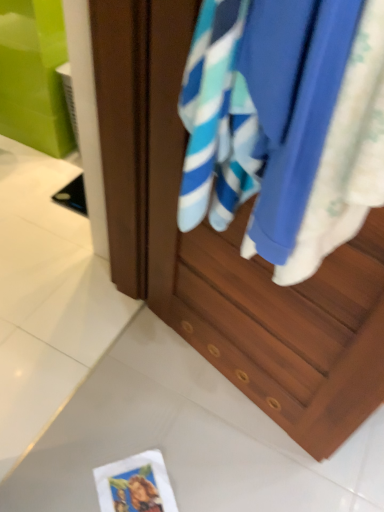
The width and height of the screenshot is (384, 512). I want to click on free spot behind white paper postcard at lower center, so click(156, 428).